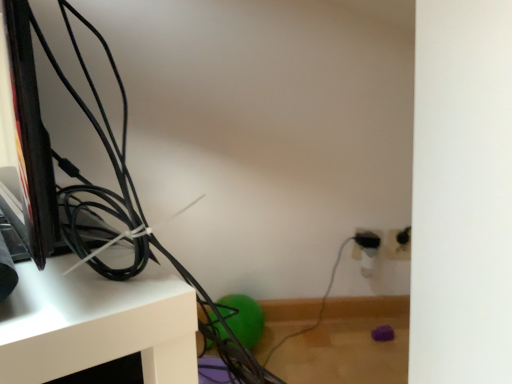
Question: Is there a large distance between black plastic electric outlet at right, marked as the second electric outlet in a right-to-left arrangement, and white glossy shelf at upper left?

Choices:
 (A) no
 (B) yes

Answer: (A)

Question: Is black plastic electric outlet at right, placed as the first electric outlet when sorted from left to right, thinner than white glossy shelf at upper left?

Choices:
 (A) no
 (B) yes

Answer: (B)

Question: Does black plastic electric outlet at right, marked as the second electric outlet in a right-to-left arrangement, have a greater height compared to white glossy shelf at upper left?

Choices:
 (A) yes
 (B) no

Answer: (B)

Question: From a real-world perspective, is black plastic electric outlet at right, marked as the second electric outlet in a right-to-left arrangement, on white glossy shelf at upper left?

Choices:
 (A) no
 (B) yes

Answer: (B)

Question: Is black plastic electric outlet at right, marked as the second electric outlet in a right-to-left arrangement, looking in the opposite direction of white glossy shelf at upper left?

Choices:
 (A) yes
 (B) no

Answer: (B)

Question: In terms of height, does white plastic electric outlet at lower right, the 2th electric outlet from the left, look taller or shorter compared to black plastic electric outlet at right, marked as the second electric outlet in a right-to-left arrangement?

Choices:
 (A) short
 (B) tall

Answer: (A)

Question: Do you think white plastic electric outlet at lower right, the 2th electric outlet from the left, is within black plastic electric outlet at right, placed as the first electric outlet when sorted from left to right, or outside of it?

Choices:
 (A) outside
 (B) inside

Answer: (A)

Question: Is white plastic electric outlet at lower right, the 2th electric outlet from the left, wider or thinner than black plastic electric outlet at right, placed as the first electric outlet when sorted from left to right?

Choices:
 (A) wide
 (B) thin

Answer: (B)

Question: From a real-world perspective, is white plastic electric outlet at lower right, the 2th electric outlet from the left, physically located above or below black plastic electric outlet at right, marked as the second electric outlet in a right-to-left arrangement?

Choices:
 (A) above
 (B) below

Answer: (A)

Question: In terms of size, does white plastic electric outlet at lower right, the 1th electric outlet in the right-to-left sequence, appear bigger or smaller than white glossy shelf at upper left?

Choices:
 (A) big
 (B) small

Answer: (B)

Question: In the image, is white plastic electric outlet at lower right, the 1th electric outlet in the right-to-left sequence, positioned in front of or behind white glossy shelf at upper left?

Choices:
 (A) front
 (B) behind

Answer: (B)

Question: From the image's perspective, is white plastic electric outlet at lower right, the 2th electric outlet from the left, above or below white glossy shelf at upper left?

Choices:
 (A) below
 (B) above

Answer: (B)

Question: Considering the positions of point (393, 236) and point (148, 279), is point (393, 236) closer or farther from the camera than point (148, 279)?

Choices:
 (A) closer
 (B) farther

Answer: (B)

Question: Considering the positions of black plastic electric outlet at right, placed as the first electric outlet when sorted from left to right, and white plastic electric outlet at lower right, the 1th electric outlet in the right-to-left sequence, in the image, is black plastic electric outlet at right, placed as the first electric outlet when sorted from left to right, bigger or smaller than white plastic electric outlet at lower right, the 1th electric outlet in the right-to-left sequence,?

Choices:
 (A) small
 (B) big

Answer: (B)

Question: Is black plastic electric outlet at right, marked as the second electric outlet in a right-to-left arrangement, taller or shorter than white plastic electric outlet at lower right, the 1th electric outlet in the right-to-left sequence?

Choices:
 (A) tall
 (B) short

Answer: (A)